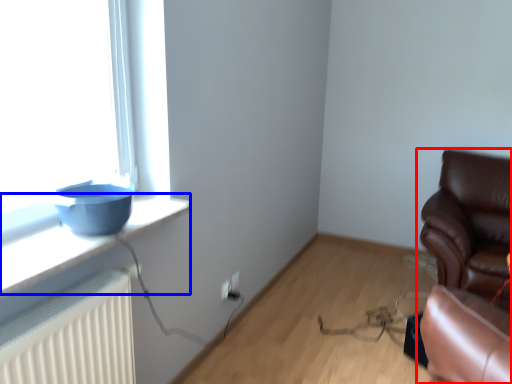
Question: Which point is closer to the camera, chair (highlighted by a red box) or window sill (highlighted by a blue box)?

Choices:
 (A) chair
 (B) window sill

Answer: (B)